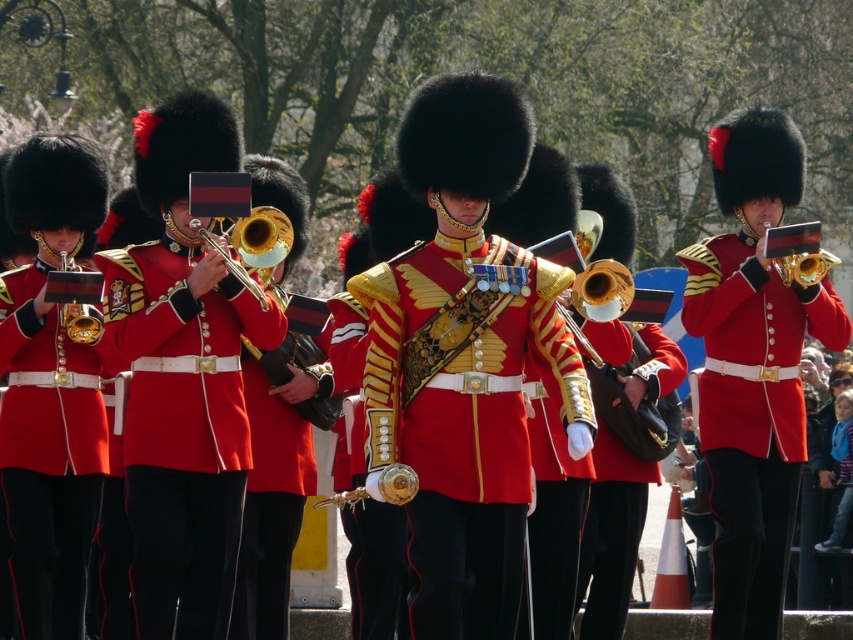
Can you confirm if shiny gold sword at center is wider than gold brass trumpet at center?

Yes.

Is the position of shiny gold sword at center less distant than that of gold brass trumpet at center?

Yes, shiny gold sword at center is closer to the viewer.

This screenshot has height=640, width=853. What are the coordinates of `shiny gold sword at center` in the screenshot? It's located at (376, 570).

Locate an element on the screen. The width and height of the screenshot is (853, 640). shiny gold sword at center is located at coordinates (376, 570).

Does matte gold trumpet at left lie behind matte gold trumpet at center?

No, it is not.

Does matte gold trumpet at left have a greater width compared to matte gold trumpet at center?

Incorrect, matte gold trumpet at left's width does not surpass matte gold trumpet at center's.

Which is in front, point (155, 481) or point (730, 634)?

Point (155, 481)

At what (x,y) coordinates should I click in order to perform the action: click on matte gold trumpet at left. Please return your answer as a coordinate pair (x, y). Looking at the image, I should click on (183, 428).

Is shiny gold trumpet at left wider than shiny gold sword at center?

Yes.

Based on the photo, who is more forward, (53, 472) or (347, 394)?

Point (53, 472)

The image size is (853, 640). What are the coordinates of `shiny gold trumpet at left` in the screenshot? It's located at (48, 454).